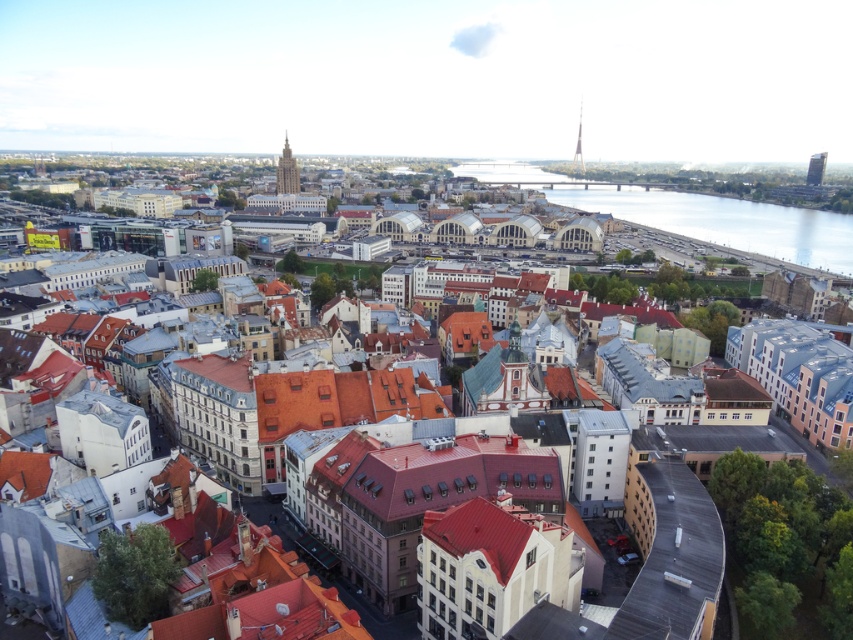
You are a city planner reviewing this area. You need to decide where to place a new public park. Considering the space available, which tower area has more room for expansion? Please choose between the matte gray tower at center and the smooth glass tower at upper right.

The matte gray tower at center is larger in size than the smooth glass tower at upper right, so the area around the matte gray tower at center likely has more space for expansion.

In the scene shown: You are a city planner reviewing this area. You need to determine which object, the reflective glass waterway at center or the smooth glass skyscraper at right, occupies more space in the image. Based on the scene, which one is larger?

The reflective glass waterway at center has a larger size compared to the smooth glass skyscraper at right, so the reflective glass waterway at center occupies more space in the image.

You are an architect analyzing the city layout. You observe the matte gray tower at center and the smooth glass tower at upper right. Which tower is located to the left of the other?

The matte gray tower at center is positioned on the left side of the smooth glass tower at upper right.